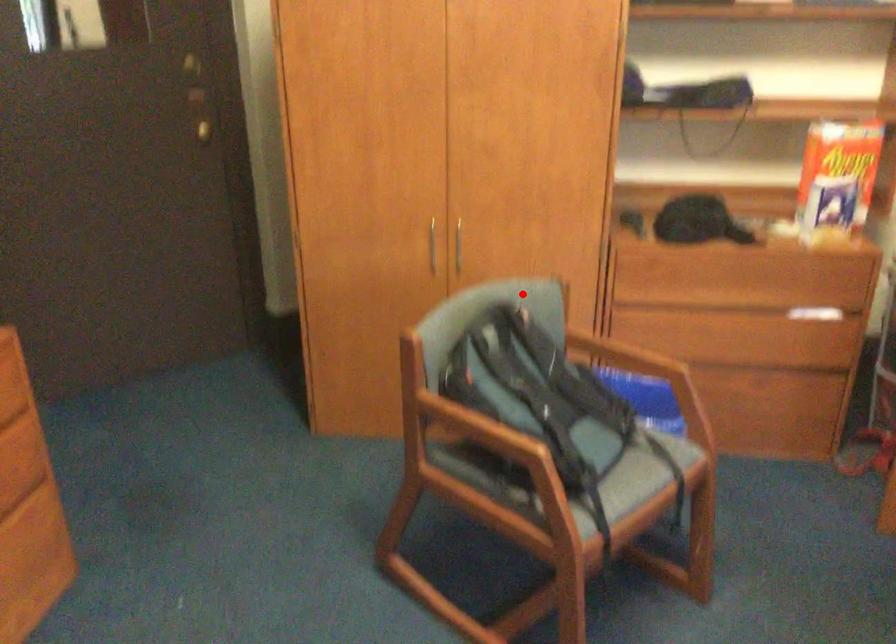
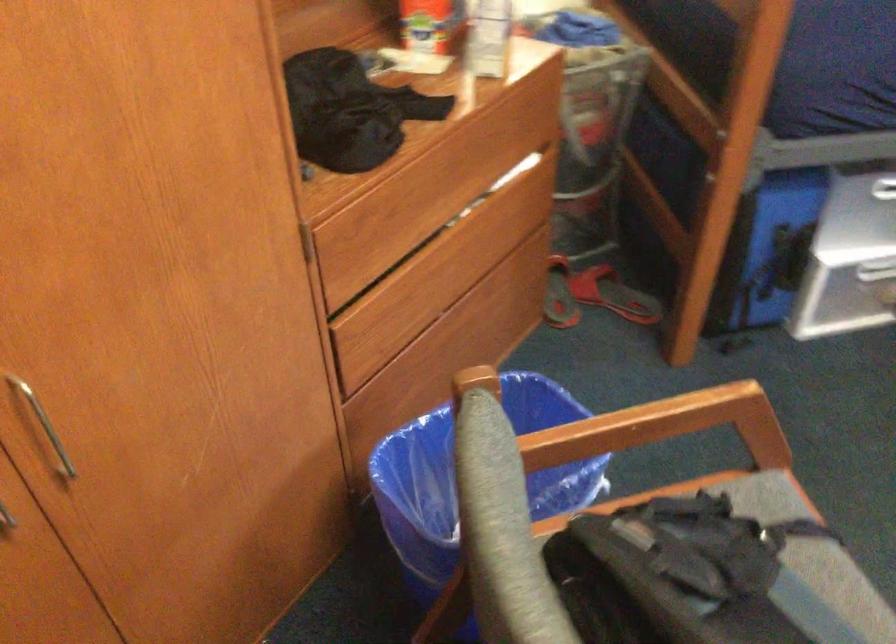
Question: I am providing you with two images of the same scene from different viewpoints. Given a red point in image1, look at the same physical point in image2. Is it:

Choices:
 (A) Closer to the viewpoint
 (B) Farther from the viewpoint

Answer: (A)